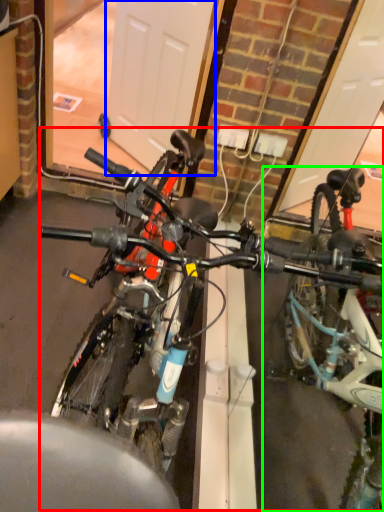
Question: Based on their relative distances, which object is nearer to bicycle (highlighted by a red box)? Choose from garage door (highlighted by a blue box) and bicycle (highlighted by a green box).

Choices:
 (A) garage door
 (B) bicycle

Answer: (B)